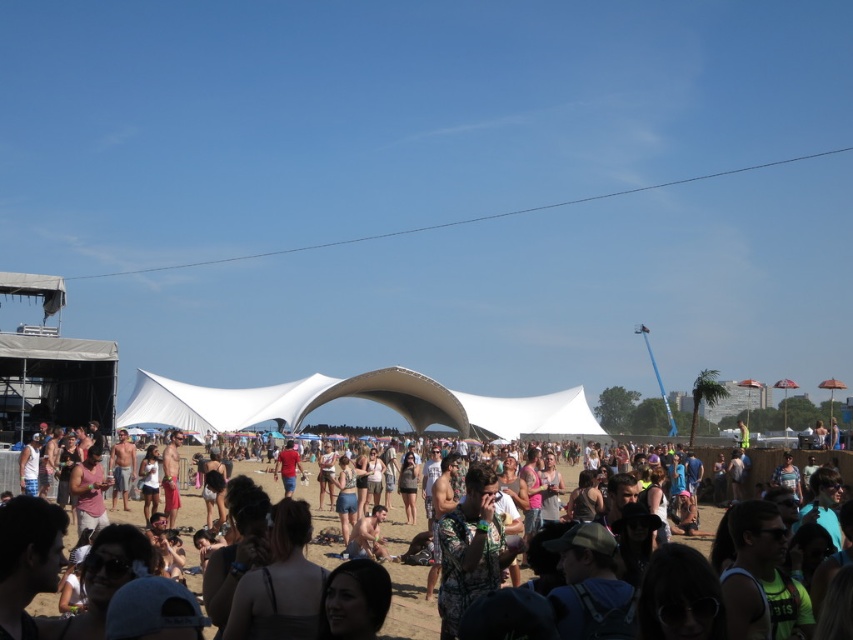
Question: Among these objects, which one is farthest from the camera?

Choices:
 (A) floral print shirt at center
 (B) white fabric canopy at center

Answer: (B)

Question: Does white fabric canopy at center lie in front of floral print shirt at center?

Choices:
 (A) yes
 (B) no

Answer: (B)

Question: Is white fabric canopy at center to the right of floral print shirt at center from the viewer's perspective?

Choices:
 (A) yes
 (B) no

Answer: (B)

Question: Which of the following is the farthest from the observer?

Choices:
 (A) white fabric canopy at center
 (B) floral print shirt at center

Answer: (A)

Question: Can you confirm if white fabric canopy at center is positioned to the right of floral print shirt at center?

Choices:
 (A) no
 (B) yes

Answer: (A)